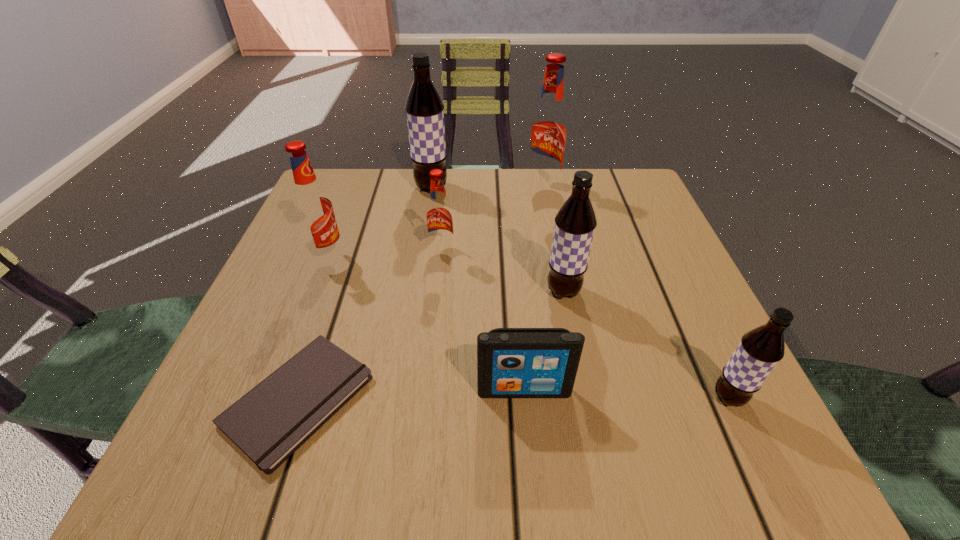
At what (x,y) coordinates should I click in order to perform the action: click on free location located 0.330m on the back of the checkbook. Please return your answer as a coordinate pair (x, y). Looking at the image, I should click on (359, 221).

Locate an element on the screen. object that is at the near edge is located at coordinates (269, 423).

The image size is (960, 540). Find the location of `root beer that is at the left edge`. root beer that is at the left edge is located at coordinates coord(312,206).

This screenshot has height=540, width=960. I want to click on checkbook present at the left edge, so click(269, 423).

Find the location of a particular element. object situated at the right edge is located at coordinates (759, 351).

Image resolution: width=960 pixels, height=540 pixels. Identify the location of object situated at the near left corner. (269, 423).

In the image, there is a desktop. Identify the location of vacant space at the far edge. (562, 180).

Find the location of a particular element. This screenshot has height=540, width=960. vacant region at the near edge is located at coordinates (381, 478).

In order to click on vacant position at the left edge of the desktop in this screenshot , I will do `click(339, 232)`.

Where is `free space at the right edge`? The height and width of the screenshot is (540, 960). free space at the right edge is located at coordinates (622, 249).